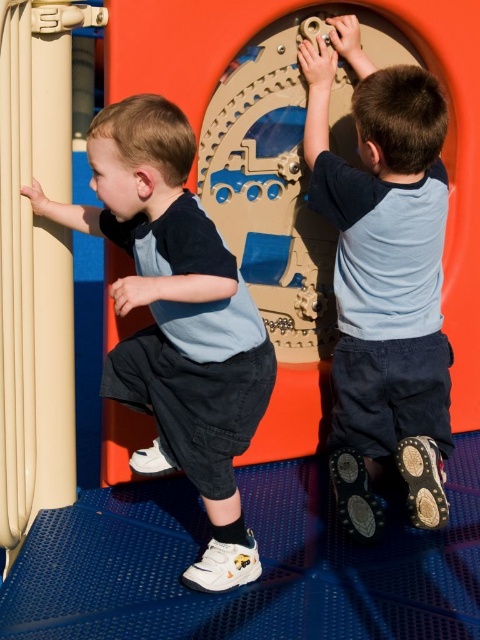
Question: Can you confirm if light blue t-shirt at upper right is thinner than matte blue shirt at left?

Choices:
 (A) yes
 (B) no

Answer: (A)

Question: Does matte blue shirt at left lie behind smooth orange slide at center?

Choices:
 (A) no
 (B) yes

Answer: (A)

Question: Can you confirm if light blue t-shirt at upper right is positioned below smooth orange slide at center?

Choices:
 (A) yes
 (B) no

Answer: (A)

Question: Estimate the real-world distances between objects in this image. Which object is closer to the light blue t-shirt at upper right?

Choices:
 (A) smooth orange slide at center
 (B) matte blue shirt at left

Answer: (A)

Question: Which object appears closest to the camera in this image?

Choices:
 (A) smooth orange slide at center
 (B) matte blue shirt at left
 (C) light blue t-shirt at upper right

Answer: (B)

Question: Which point is closer to the camera?

Choices:
 (A) smooth orange slide at center
 (B) matte blue shirt at left
 (C) light blue t-shirt at upper right

Answer: (B)